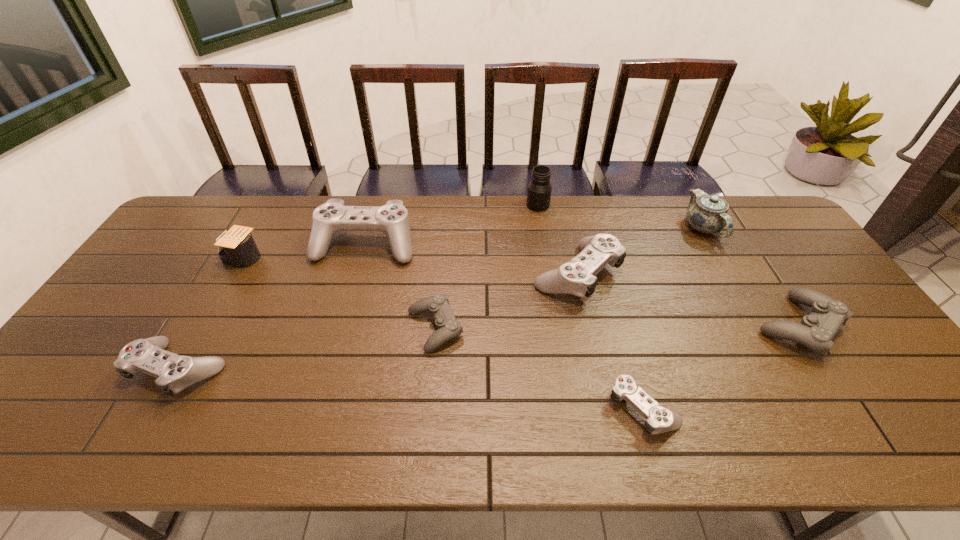
Locate an element on the screen. The width and height of the screenshot is (960, 540). jar is located at coordinates (539, 191).

At what (x,y) coordinates should I click in order to perform the action: click on chinaware. Please return your answer as a coordinate pair (x, y). The width and height of the screenshot is (960, 540). Looking at the image, I should click on (706, 213).

At what (x,y) coordinates should I click in order to perform the action: click on the seventh object from right to left. Please return your answer as a coordinate pair (x, y). This screenshot has width=960, height=540. Looking at the image, I should click on (392, 219).

Find the location of a particular element. The width and height of the screenshot is (960, 540). the biggest white control is located at coordinates (392, 219).

The image size is (960, 540). I want to click on the third smallest white control, so click(x=577, y=277).

Locate an element on the screen. calculator is located at coordinates (236, 247).

You are a GUI agent. You are given a task and a screenshot of the screen. Output one action in this format:
    pyautogui.click(x=<x>, y=<y>)
    Task: Click on the rightmost control
    
    Given the screenshot: What is the action you would take?
    pyautogui.click(x=816, y=331)

Image resolution: width=960 pixels, height=540 pixels. I want to click on the right gray control, so click(816, 331).

In order to click on the leftmost white control in this screenshot , I will do `click(174, 373)`.

Identify the location of the third biggest white control. (174, 373).